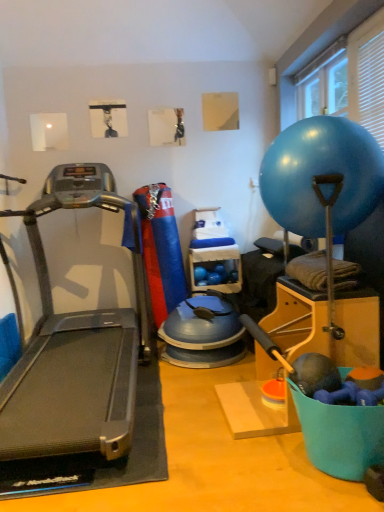
Question: Visually, is silver metallic treadmill at left positioned to the left or to the right of blue rubber ball at upper right?

Choices:
 (A) right
 (B) left

Answer: (B)

Question: Considering the positions of point (137, 265) and point (319, 180), is point (137, 265) closer or farther from the camera than point (319, 180)?

Choices:
 (A) farther
 (B) closer

Answer: (A)

Question: Based on their relative distances, which object is farther from the blue rubber ball at upper right?

Choices:
 (A) silver metallic treadmill at left
 (B) clear plastic container at center
 (C) transparent plastic window screen at upper right

Answer: (B)

Question: Considering the real-world distances, which object is farthest from the silver metallic treadmill at left?

Choices:
 (A) transparent plastic window screen at upper right
 (B) blue rubber ball at upper right
 (C) clear plastic container at center

Answer: (A)